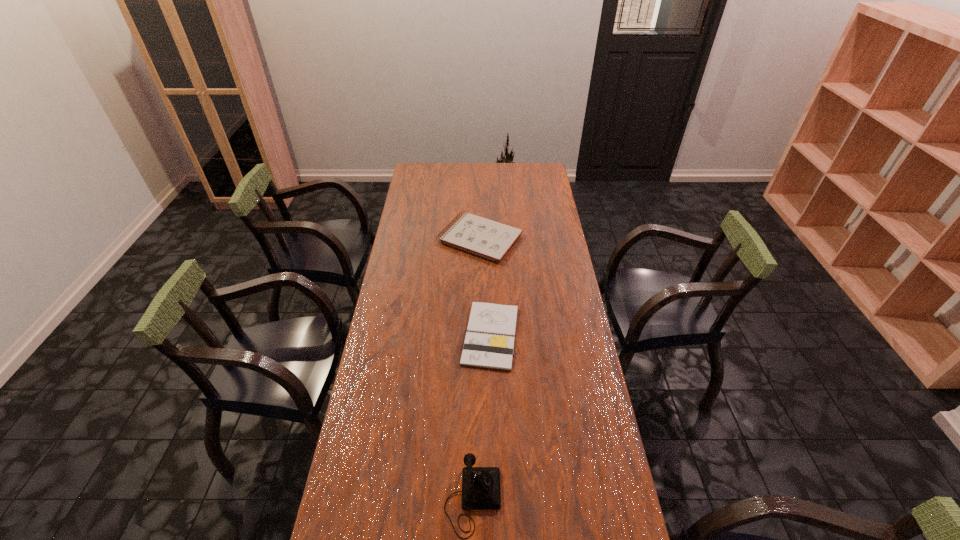
This screenshot has width=960, height=540. Identify the location of the nearest object. (480, 485).

This screenshot has width=960, height=540. I want to click on telephone, so click(x=480, y=485).

At what (x,y) coordinates should I click in order to perform the action: click on the farther notepad. Please return your answer as a coordinate pair (x, y). The width and height of the screenshot is (960, 540). Looking at the image, I should click on (481, 236).

Locate an element on the screen. This screenshot has height=540, width=960. the second shortest object is located at coordinates (481, 236).

Identify the location of the nearer notepad. (489, 342).

Image resolution: width=960 pixels, height=540 pixels. Find the location of `the shorter notepad`. the shorter notepad is located at coordinates (489, 342).

Where is `vacant area located on the front face of the tallest object`? vacant area located on the front face of the tallest object is located at coordinates (615, 498).

You are a GUI agent. You are given a task and a screenshot of the screen. Output one action in this format:
    pyautogui.click(x=<x>, y=<y>)
    Task: Click on the vacant region located 0.090m on the right of the second shortest object
    
    Given the screenshot: What is the action you would take?
    pyautogui.click(x=543, y=239)

At what (x,y) coordinates should I click in order to perform the action: click on free space located 0.290m on the back of the shortest object. Please return your answer as a coordinate pair (x, y). This screenshot has width=960, height=540. Looking at the image, I should click on (489, 255).

You are a GUI agent. You are given a task and a screenshot of the screen. Output one action in this format:
    pyautogui.click(x=<x>, y=<y>)
    Task: Click on the vacant space at the far edge of the desktop
    
    Given the screenshot: What is the action you would take?
    pyautogui.click(x=499, y=174)